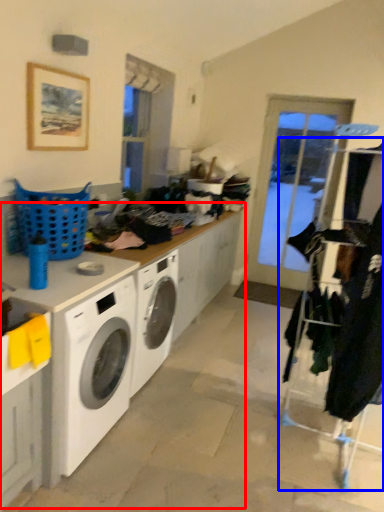
Question: Among these objects, which one is nearest to the camera, counter top (highlighted by a red box) or closet (highlighted by a blue box)?

Choices:
 (A) counter top
 (B) closet

Answer: (A)